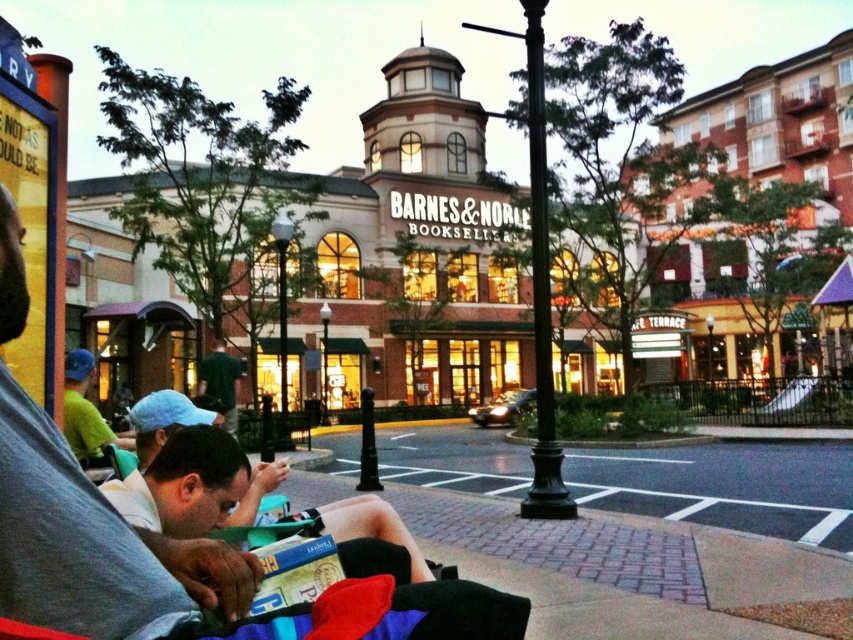
Question: Which point is farther to the camera?

Choices:
 (A) green fabric shirt at left
 (B) dark green shirt at center
 (C) brick building at center
 (D) gray cotton shirt at lower left

Answer: (C)

Question: Does brick building at center have a lesser width compared to dark green shirt at center?

Choices:
 (A) no
 (B) yes

Answer: (A)

Question: Among these objects, which one is nearest to the camera?

Choices:
 (A) gray cotton shirt at lower left
 (B) green fabric shirt at left

Answer: (A)

Question: Estimate the real-world distances between objects in this image. Which object is closer to the gray cotton shirt at lower left?

Choices:
 (A) dark green shirt at center
 (B) green fabric shirt at left
 (C) brick building at center

Answer: (B)

Question: Is green fabric shirt at left further to the viewer compared to dark green shirt at center?

Choices:
 (A) yes
 (B) no

Answer: (B)

Question: Observing the image, what is the correct spatial positioning of brick building at center in reference to dark green shirt at center?

Choices:
 (A) left
 (B) right

Answer: (B)